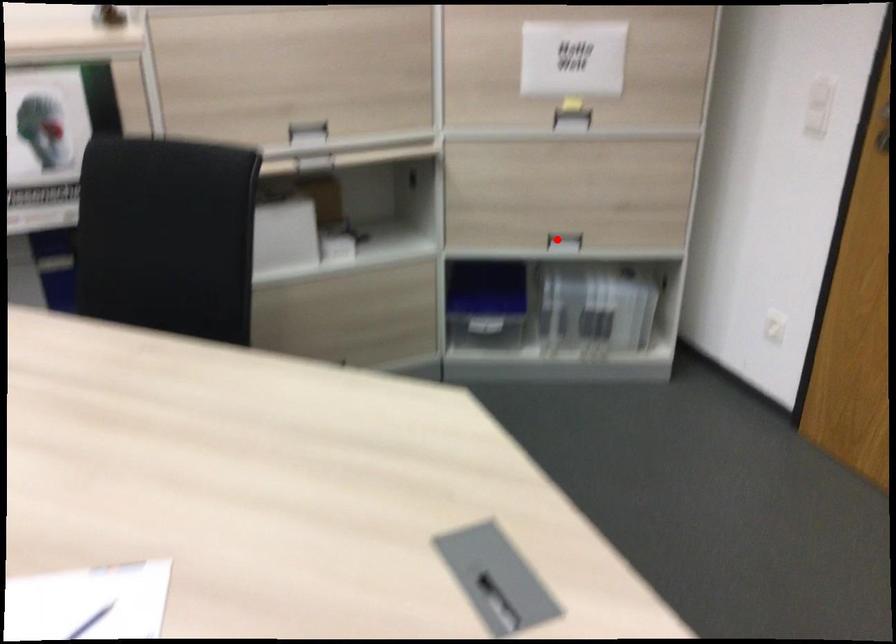
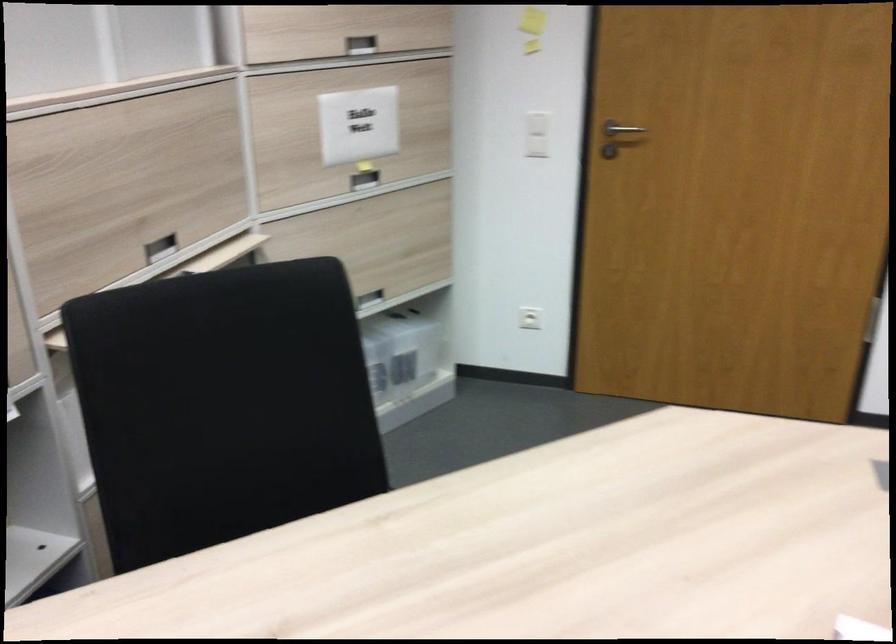
Locate, in the second image, the point that corresponds to the highlighted location in the first image.

(368, 299)